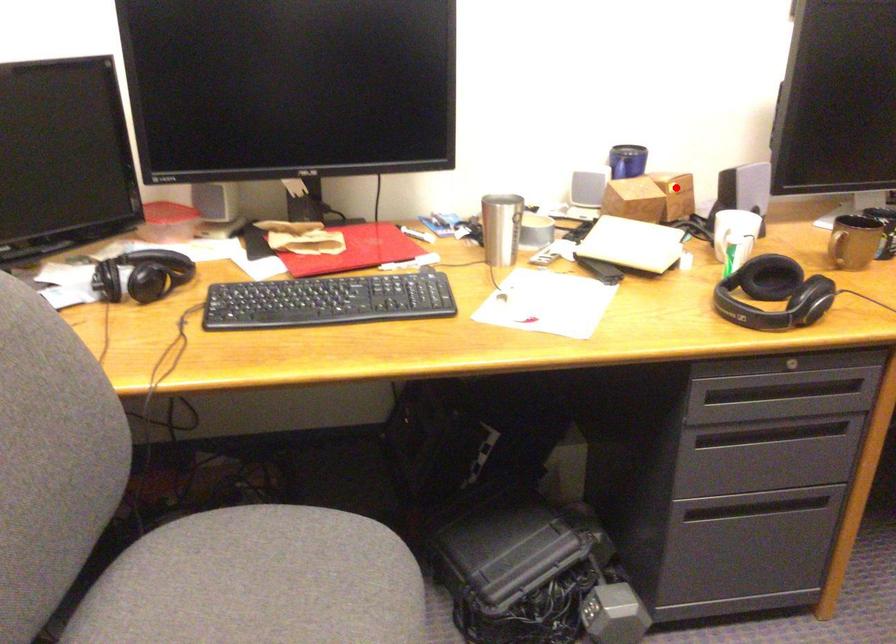
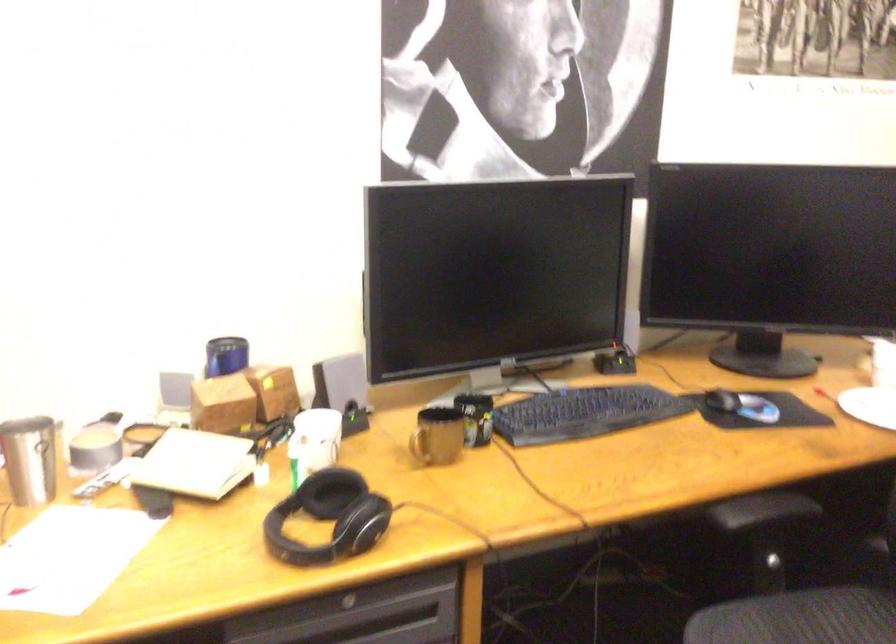
Where in the second image is the point corresponding to the highlighted location from the first image?

(272, 392)